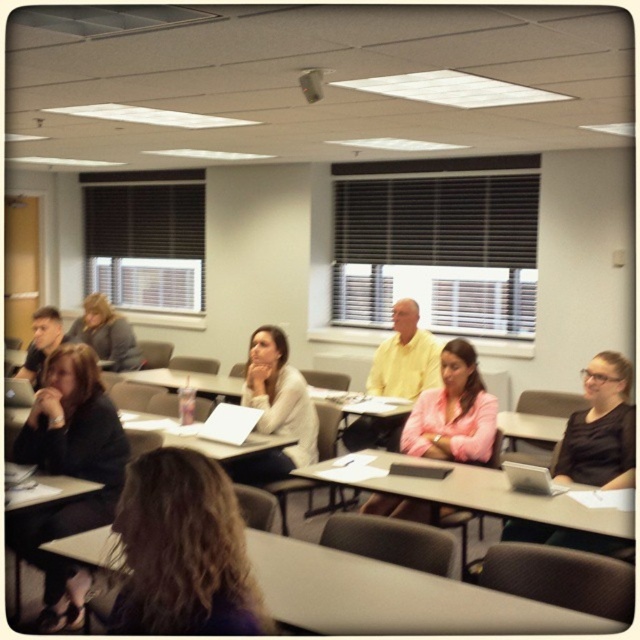
You are organizing a photo shoot and need to place two jackets on a shelf. The shelf has limited space. Given that you have the matte black jacket at left and the pink matte jacket at center, which jacket would you choose to place first to ensure both fit on the shelf?

The matte black jacket at left has a smaller width than the pink matte jacket at center, so you should place the pink matte jacket at center first to accommodate its larger size, ensuring both jackets fit on the shelf.

You are standing in the classroom and want to take a photo of both point (80, 525) and point (488, 444) in the image. Which point should you focus on first to ensure both are in sharp focus?

You should focus on point (80, 525) first because it is closer to the camera than point (488, 444). This ensures that both points will be within the depth of field and in sharp focus.